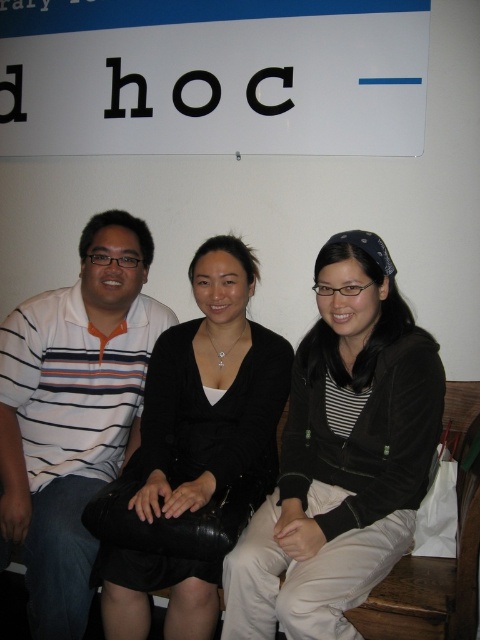
Question: Is black velvet jacket at center smaller than black matte dress at center?

Choices:
 (A) no
 (B) yes

Answer: (A)

Question: Does white paper sign at upper center lie behind white striped shirt at left?

Choices:
 (A) yes
 (B) no

Answer: (A)

Question: Which object is positioned closest to the white paper sign at upper center?

Choices:
 (A) white striped shirt at left
 (B) black velvet jacket at center
 (C) black matte dress at center

Answer: (A)

Question: Which object is farther from the camera taking this photo?

Choices:
 (A) white striped shirt at left
 (B) black matte dress at center
 (C) black velvet jacket at center

Answer: (A)

Question: Which of the following is the farthest from the observer?

Choices:
 (A) white striped shirt at left
 (B) black velvet jacket at center
 (C) white paper sign at upper center

Answer: (C)

Question: Is white striped shirt at left below black matte dress at center?

Choices:
 (A) yes
 (B) no

Answer: (B)